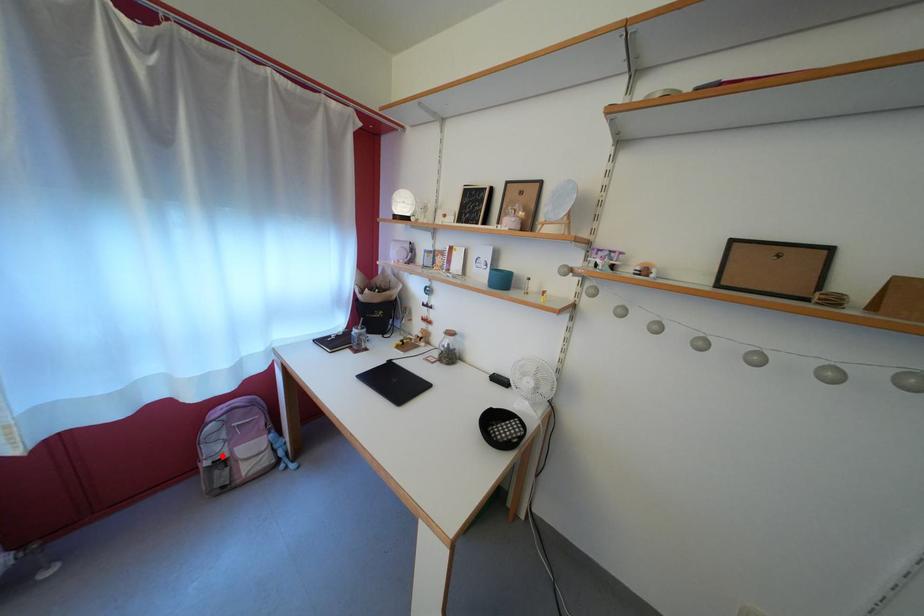
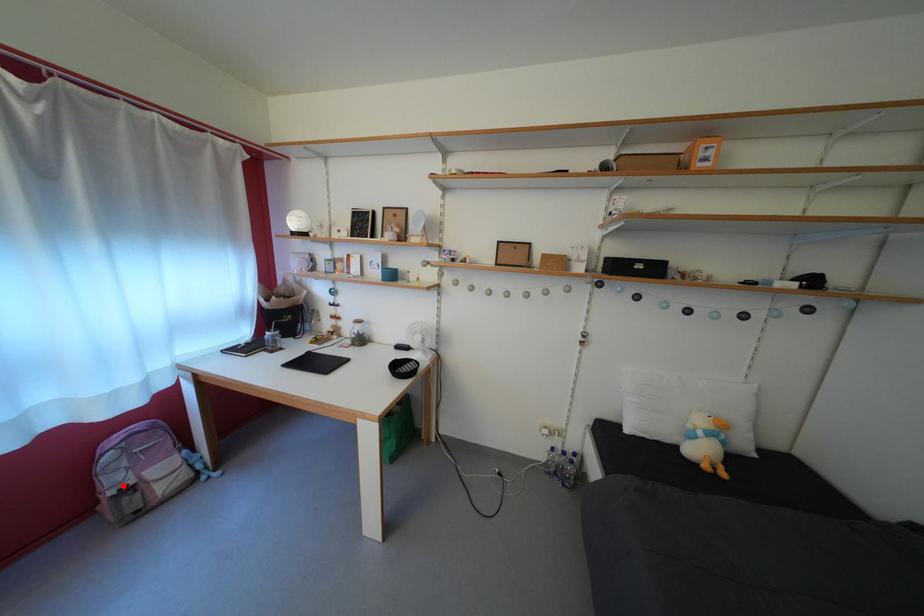
I am providing you with two images of the same scene from different viewpoints. A red point is marked on the first image and another point is marked on the second image. Do the highlighted points in image1 and image2 indicate the same real-world spot?

Yes